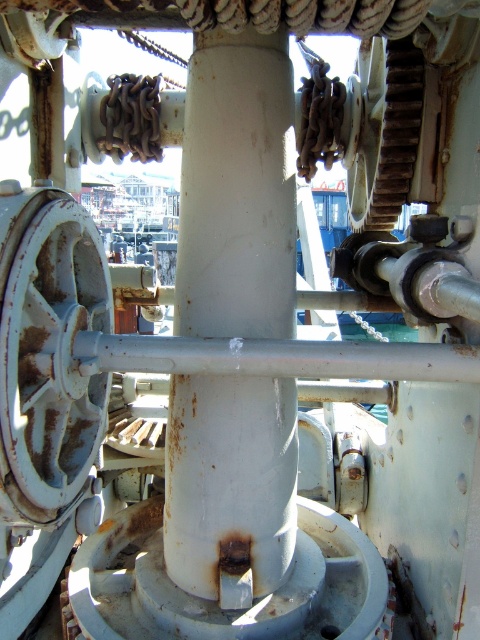
Question: Does rusty metal gear at lower left appear on the left side of rusty metal gear at upper right?

Choices:
 (A) no
 (B) yes

Answer: (B)

Question: From the image, what is the correct spatial relationship of rusty metal gear at lower left in relation to rusty metal gear at upper right?

Choices:
 (A) right
 (B) left

Answer: (B)

Question: Is rusty metal gear at lower left thinner than rusty metal gear at upper right?

Choices:
 (A) no
 (B) yes

Answer: (B)

Question: Which point is farther to the camera?

Choices:
 (A) (95, 417)
 (B) (396, 108)

Answer: (B)

Question: Which object appears closest to the camera in this image?

Choices:
 (A) rusty metal gear at lower left
 (B) rusty metal gear at upper right

Answer: (A)

Question: Which object is farther from the camera taking this photo?

Choices:
 (A) rusty metal gear at upper right
 (B) rusty metal gear at lower left

Answer: (A)